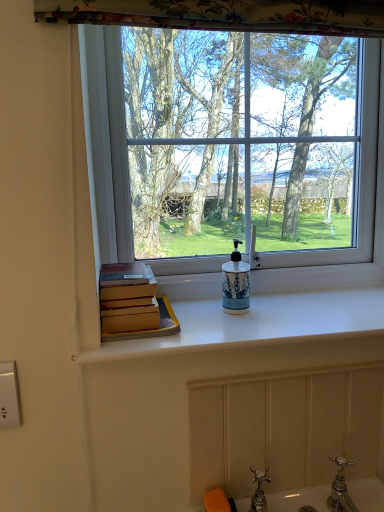
Image resolution: width=384 pixels, height=512 pixels. Find the location of `vacant region above white glossy counter top at center (from a real-world perspective)`. vacant region above white glossy counter top at center (from a real-world perspective) is located at coordinates (274, 307).